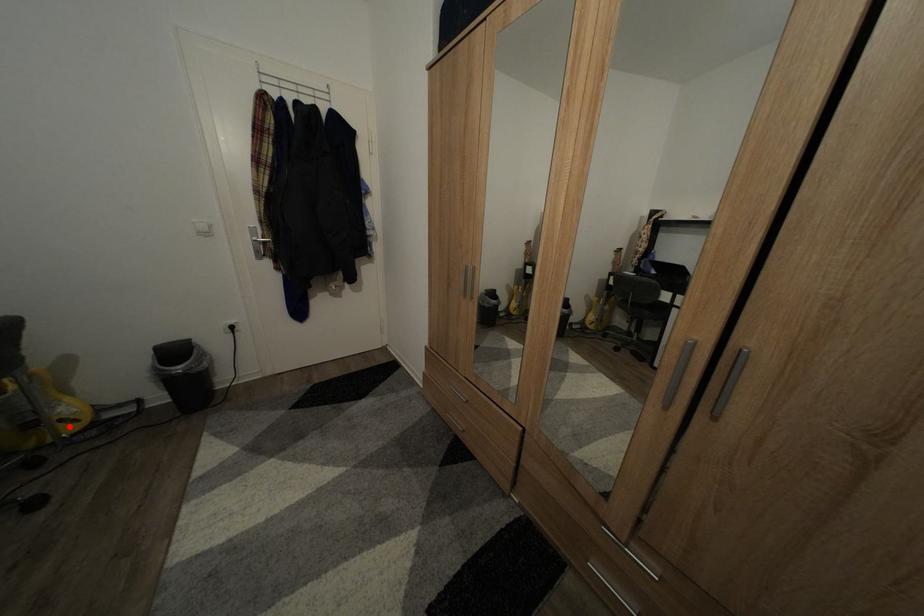
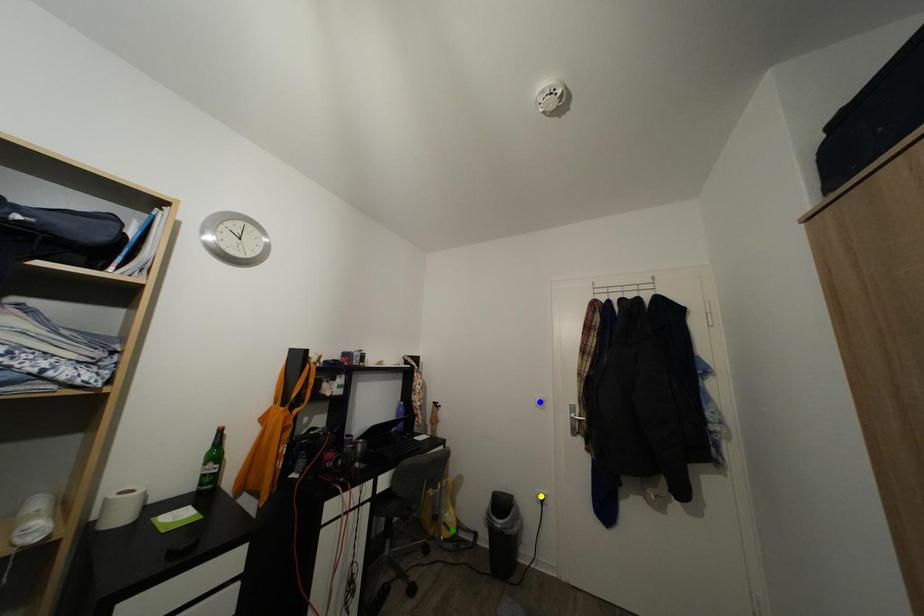
Question: I am providing you with two images of the same scene from different viewpoints. A red point is marked on the first image. You are given multiple points on the second image. In image 2, which mark is for the same physical point as the one in image 1?

Choices:
 (A) yellow point
 (B) green point
 (C) blue point

Answer: (B)